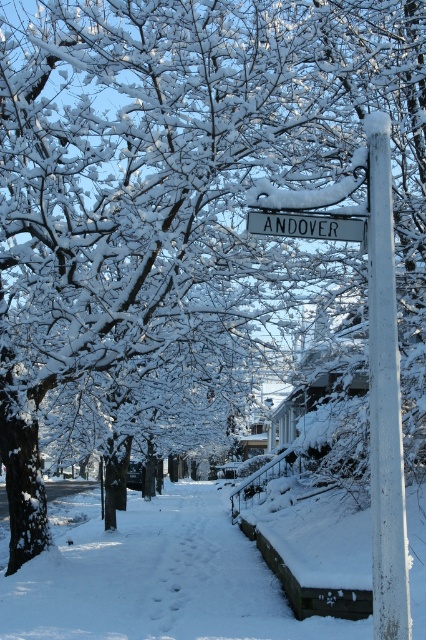
Question: Considering the relative positions of white powdery snow at center and white painted wood post at center right in the image provided, where is white powdery snow at center located with respect to white painted wood post at center right?

Choices:
 (A) below
 (B) above

Answer: (A)

Question: Which of these objects is positioned farthest from the white plastic sign at center?

Choices:
 (A) white powdery snow at center
 (B) white painted wood post at center right

Answer: (A)

Question: Among these points, which one is farthest from the camera?

Choices:
 (A) (288, 218)
 (B) (400, 636)
 (C) (192, 577)

Answer: (C)

Question: Which object is positioned closest to the white plastic sign at center?

Choices:
 (A) white painted wood post at center right
 (B) white powdery snow at center

Answer: (A)

Question: Is white painted wood post at center right further to the viewer compared to white plastic sign at center?

Choices:
 (A) yes
 (B) no

Answer: (B)

Question: Does white painted wood post at center right have a lesser width compared to white plastic sign at center?

Choices:
 (A) yes
 (B) no

Answer: (A)